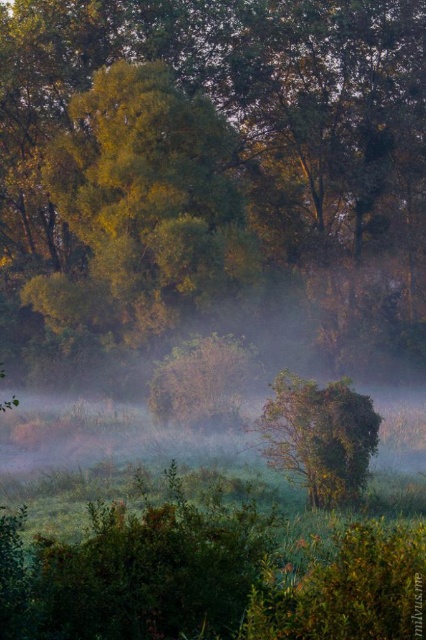
Question: Estimate the real-world distances between objects in this image. Which object is farther from the green leafy tree at center?

Choices:
 (A) green leafy tree at upper left
 (B) green leafy tree at upper center

Answer: (B)

Question: Which object is closer to the camera taking this photo?

Choices:
 (A) green leafy tree at upper center
 (B) green leafy tree at upper left

Answer: (B)

Question: Among these points, which one is nearest to the camera?

Choices:
 (A) (232, 19)
 (B) (304, 426)
 (C) (108, 316)

Answer: (B)

Question: Does green leafy tree at upper left have a lesser width compared to green leafy tree at center?

Choices:
 (A) no
 (B) yes

Answer: (A)

Question: Does green leafy tree at upper center have a smaller size compared to green leafy tree at center?

Choices:
 (A) no
 (B) yes

Answer: (A)

Question: Can you confirm if green leafy tree at upper center is thinner than green leafy tree at center?

Choices:
 (A) no
 (B) yes

Answer: (A)